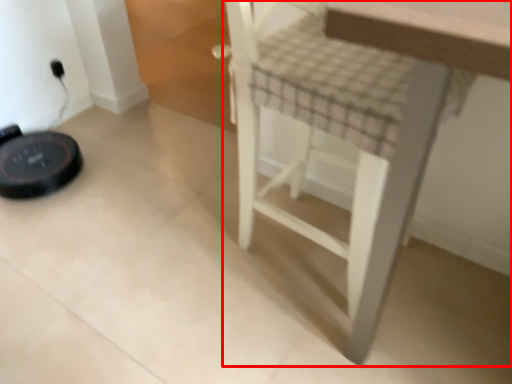
Question: From the image's perspective, where is furniture (annotated by the red box) located in relation to electric outlet in the image?

Choices:
 (A) above
 (B) below

Answer: (B)